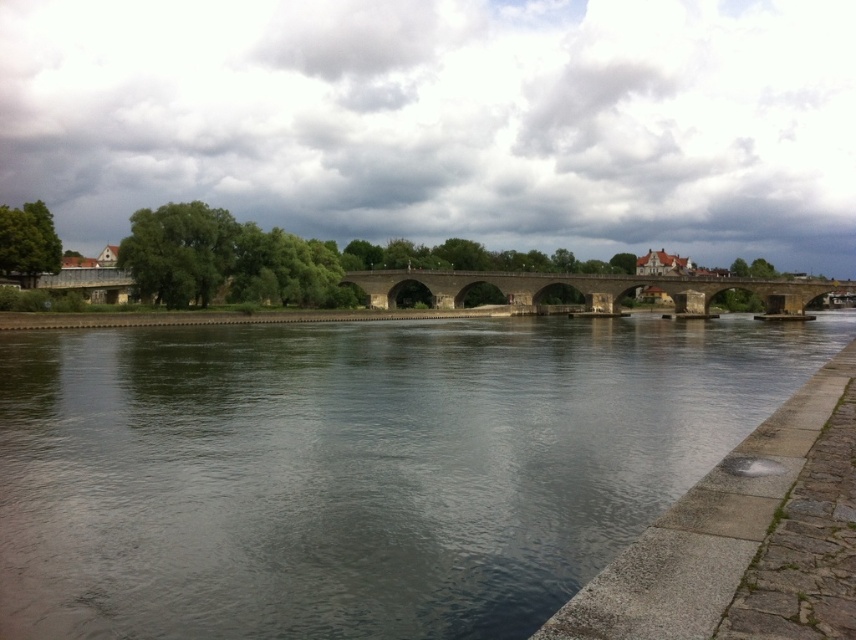
Does point (494, 582) come in front of point (462, 284)?

Yes, point (494, 582) is in front of point (462, 284).

Is point (7, 592) in front of point (385, 276)?

That is True.

The width and height of the screenshot is (856, 640). I want to click on dark gray water at center, so click(358, 467).